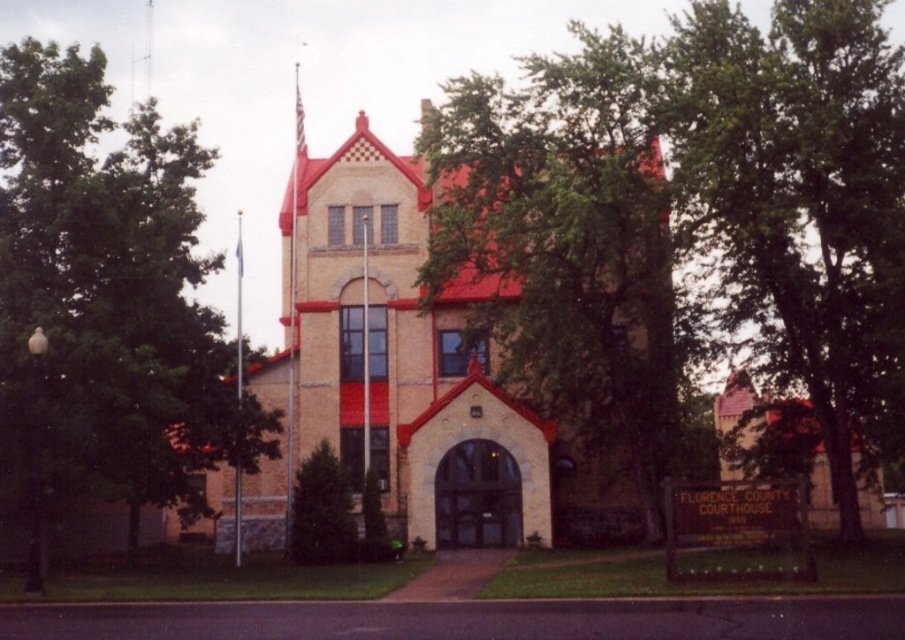
Question: Does green leafy tree at center appear on the right side of green textured evergreen tree at center?

Choices:
 (A) no
 (B) yes

Answer: (B)

Question: Is green leafy tree at center closer to camera compared to green textured evergreen tree at center?

Choices:
 (A) no
 (B) yes

Answer: (B)

Question: Considering the real-world distances, which object is closest to the beige stone church at center?

Choices:
 (A) green textured evergreen tree at center
 (B) green leafy tree at left

Answer: (B)

Question: Which of the following is the closest to the observer?

Choices:
 (A) (72, 80)
 (B) (846, 92)
 (C) (303, 476)

Answer: (B)

Question: Which point appears closest to the camera in this image?

Choices:
 (A) (243, 449)
 (B) (694, 164)
 (C) (305, 552)
 (D) (301, 202)

Answer: (B)

Question: Is green leafy tree at center positioned before green leafy tree at left?

Choices:
 (A) no
 (B) yes

Answer: (A)